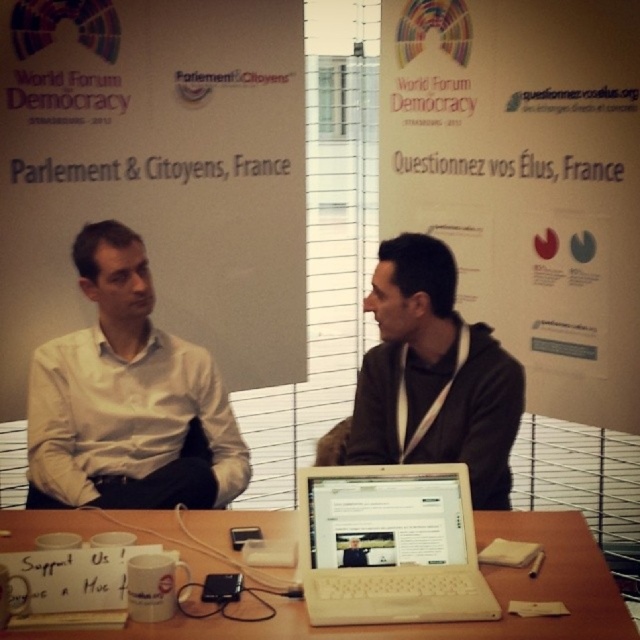
You are a photographer at the World Forum for Democracy event. You need to capture a photo of the white shirt at center and the white plastic laptop at center such that the laptop is on the right side of the shirt in the frame. Is this possible based on their current positions?

Yes, because the white shirt at center is to the left of the white plastic laptop at center, so positioning the laptop on the right side of the shirt in the frame is achievable.

You are attending the World Forum for Democracy event and need to move from your current position to the registration desk located at point (368, 518). There is an obstacle at point (180, 392). Will you need to go around the obstacle to reach the registration desk?

Since point (180, 392) is behind point (368, 518), you do not need to go around the obstacle to reach the registration desk located at point (368, 518).